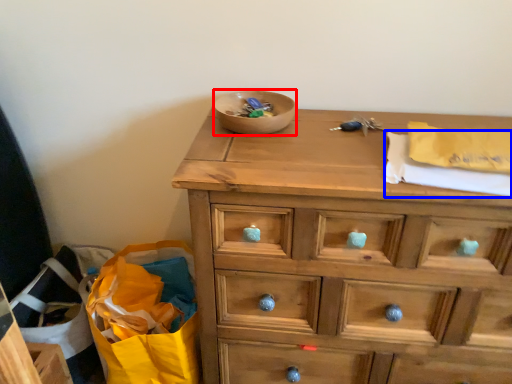
Question: Among these objects, which one is nearest to the camera, bowl (highlighted by a red box) or clothe (highlighted by a blue box)?

Choices:
 (A) bowl
 (B) clothe

Answer: (B)